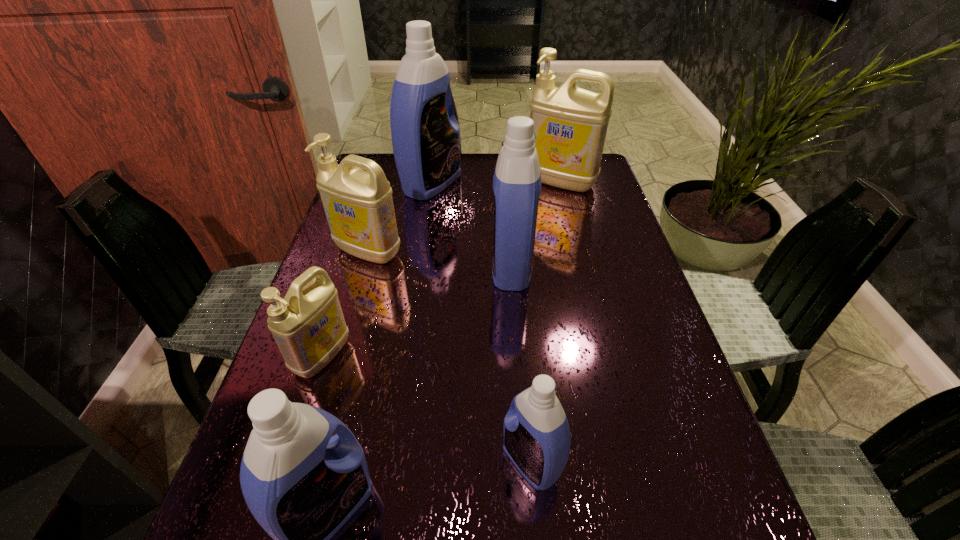
Locate an element on the screen. The width and height of the screenshot is (960, 540). the farthest blue detergent is located at coordinates (425, 134).

Image resolution: width=960 pixels, height=540 pixels. I want to click on the biggest blue detergent, so click(x=425, y=134).

The height and width of the screenshot is (540, 960). I want to click on the biggest beige detergent, so click(x=570, y=123).

Find the location of a particular element. The image size is (960, 540). the farthest beige detergent is located at coordinates (570, 123).

Where is `the third nearest blue detergent`? This screenshot has width=960, height=540. the third nearest blue detergent is located at coordinates (517, 179).

Find the location of `the second smallest beige detergent`. the second smallest beige detergent is located at coordinates (358, 204).

Locate an element on the screen. This screenshot has height=540, width=960. the third nearest object is located at coordinates [308, 325].

Find the location of a particular element. Image resolution: width=960 pixels, height=540 pixels. the smallest beige detergent is located at coordinates (308, 325).

This screenshot has height=540, width=960. Identify the location of the smallest blue detergent. (537, 439).

This screenshot has height=540, width=960. I want to click on vacant space situated on the front of the tallest object, so pyautogui.click(x=424, y=228).